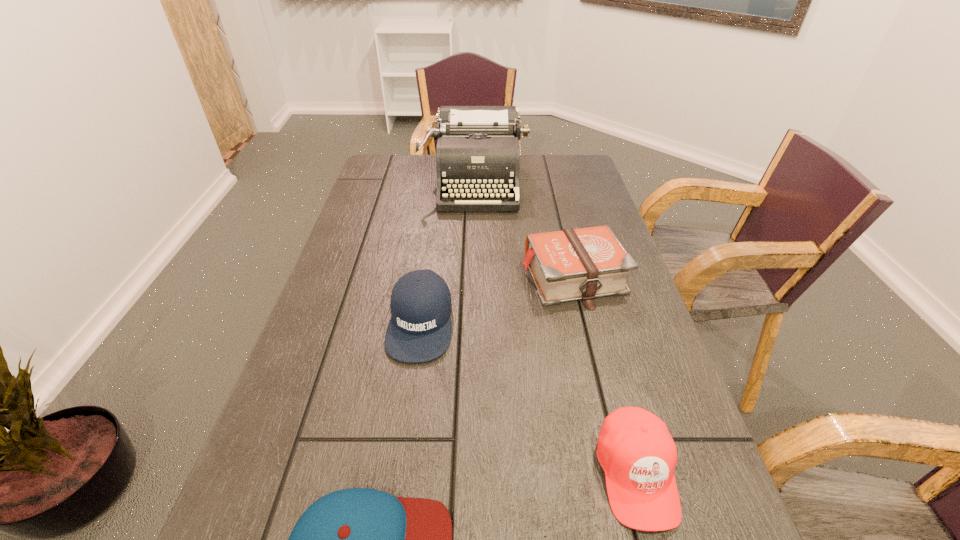
Locate an element on the screen. vacant area between the rightmost baseball cap and the Bible is located at coordinates (605, 376).

You are a GUI agent. You are given a task and a screenshot of the screen. Output one action in this format:
    pyautogui.click(x=<x>, y=<y>)
    Task: Click on the free space between the farthest object and the farthest baseball cap
    This screenshot has width=960, height=540.
    Given the screenshot: What is the action you would take?
    pyautogui.click(x=447, y=252)

Image resolution: width=960 pixels, height=540 pixels. I want to click on free point between the rightmost baseball cap and the Bible, so click(x=605, y=376).

This screenshot has width=960, height=540. I want to click on vacant space that's between the rightmost baseball cap and the Bible, so click(605, 376).

Locate an element on the screen. the closest object relative to the farthest baseball cap is located at coordinates (581, 264).

Identify which object is the second nearest to the Bible. Please provide its 2D coordinates. Your answer should be formatted as a tuple, i.e. [(x, y)], where the tuple contains the x and y coordinates of a point satisfying the conditions above.

[(477, 153)]

At what (x,y) coordinates should I click in order to perform the action: click on baseball cap that is the closest to the shortest baseball cap. Please return your answer as a coordinate pair (x, y). Looking at the image, I should click on (635, 449).

Image resolution: width=960 pixels, height=540 pixels. I want to click on the second closest baseball cap relative to the tallest object, so click(635, 449).

Where is `vacant space that satisfies the following two spatial constraints: 1. on the front-facing side of the Bible; 2. on the right side of the farthest object`? The height and width of the screenshot is (540, 960). vacant space that satisfies the following two spatial constraints: 1. on the front-facing side of the Bible; 2. on the right side of the farthest object is located at coordinates (473, 278).